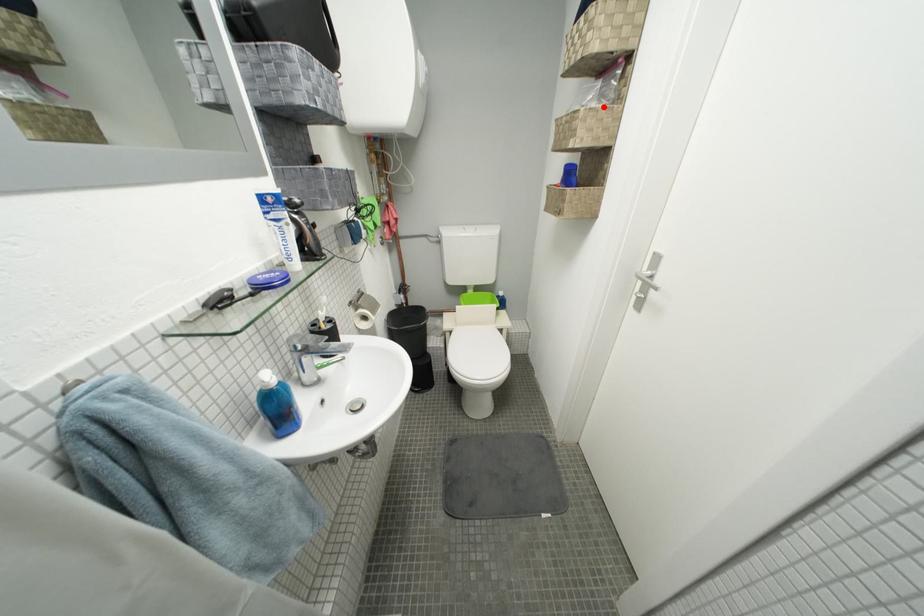
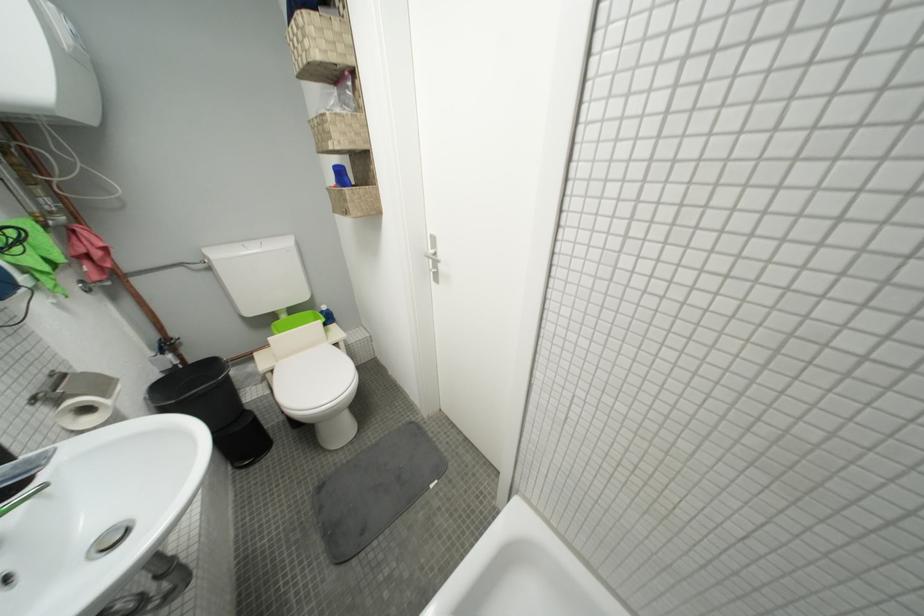
Question: I am providing you with two images of the same scene from different viewpoints. A red point is marked on the first image. Is the red point's position out of view in image 2?

Choices:
 (A) Yes
 (B) No

Answer: (B)